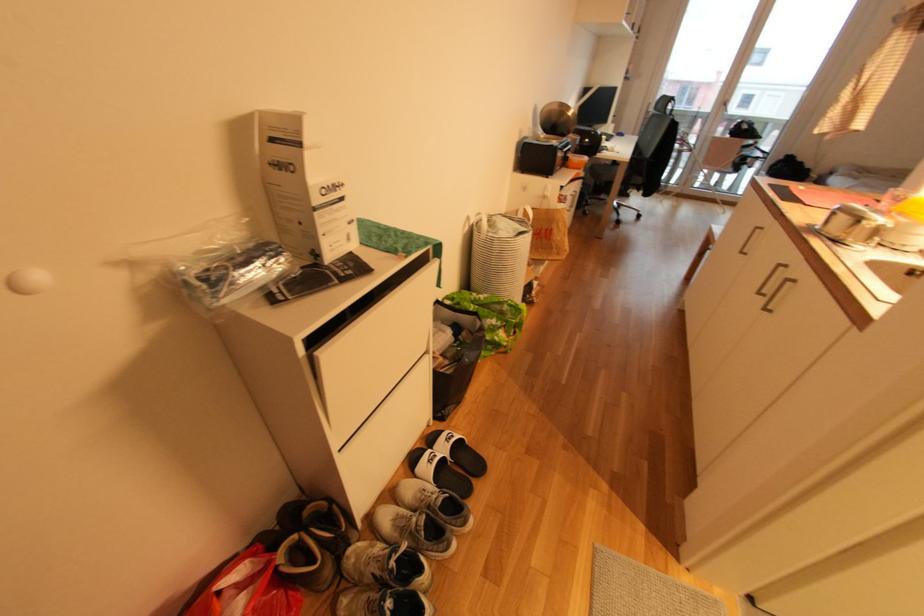
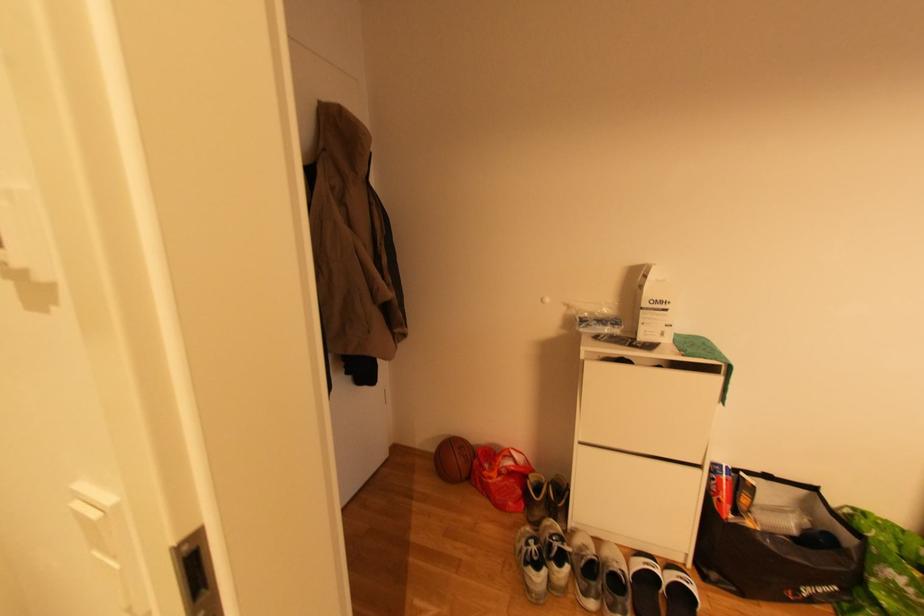
Question: The first image is from the beginning of the video and the second image is from the end. How did the camera likely rotate when shooting the video?

Choices:
 (A) Left
 (B) Right
 (C) Up
 (D) Down

Answer: (A)